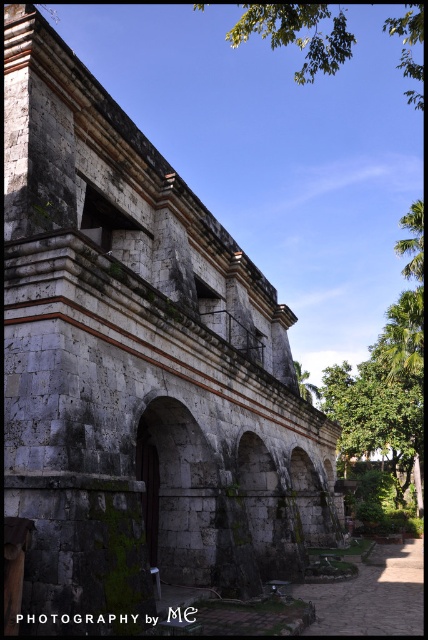
Is point (401, 413) positioned after point (406, 266)?

No, it is in front of (406, 266).

Is point (335, 392) closer to camera compared to point (422, 269)?

No, it is behind (422, 269).

What are the coordinates of `green leafy tree at right` in the screenshot? It's located at (386, 378).

Looking at this image, who is positioned more to the right, gray stone archway at center or green leafy tree at upper right?

green leafy tree at upper right is more to the right.

Is gray stone archway at center behind green leafy tree at upper right?

No, gray stone archway at center is closer to the viewer.

Measure the distance between gray stone archway at center and camera.

A distance of 48.00 meters exists between gray stone archway at center and camera.

You are a GUI agent. You are given a task and a screenshot of the screen. Output one action in this format:
    pyautogui.click(x=<x>, y=<y>)
    Task: Click on the gray stone archway at center
    
    Given the screenshot: What is the action you would take?
    [180, 493]

Does green leafy tree at right have a smaller size compared to gray stone archway at center?

No, green leafy tree at right is not smaller than gray stone archway at center.

In the scene shown: Can you confirm if green leafy tree at right is positioned to the right of gray stone archway at center?

Yes, green leafy tree at right is to the right of gray stone archway at center.

Locate an element on the screen. The width and height of the screenshot is (428, 640). green leafy tree at right is located at coordinates (386, 378).